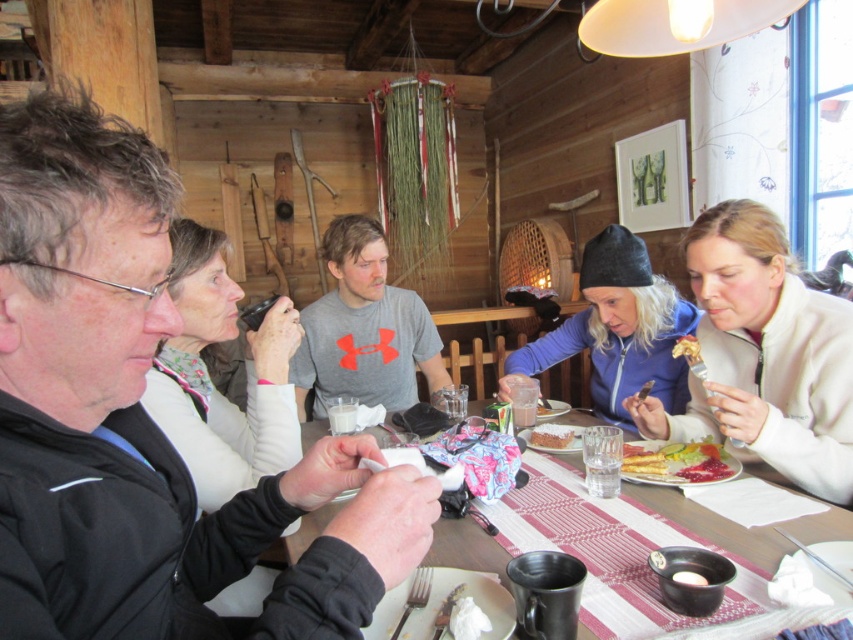
Does white fabric at upper left appear on the left side of gray matte t-shirt at center?

Indeed, white fabric at upper left is positioned on the left side of gray matte t-shirt at center.

The height and width of the screenshot is (640, 853). I want to click on white fabric at upper left, so click(x=210, y=380).

The image size is (853, 640). Describe the element at coordinates (210, 380) in the screenshot. I see `white fabric at upper left` at that location.

This screenshot has height=640, width=853. In order to click on white fabric at upper left in this screenshot , I will do tap(210, 380).

Between black matte jacket at left and spongy white cake at center, which one is positioned higher?

black matte jacket at left

Who is more distant from viewer, (347, 445) or (556, 432)?

The point (556, 432) is more distant.

Locate an element on the screen. The width and height of the screenshot is (853, 640). black matte jacket at left is located at coordinates point(144,422).

Which is below, black matte jacket at left or pink glossy jam at lower right?

pink glossy jam at lower right

Does black matte jacket at left have a lesser height compared to pink glossy jam at lower right?

No.

Is point (183, 592) positioned after point (709, 460)?

No, (183, 592) is closer to viewer.

The height and width of the screenshot is (640, 853). I want to click on black matte jacket at left, so click(x=144, y=422).